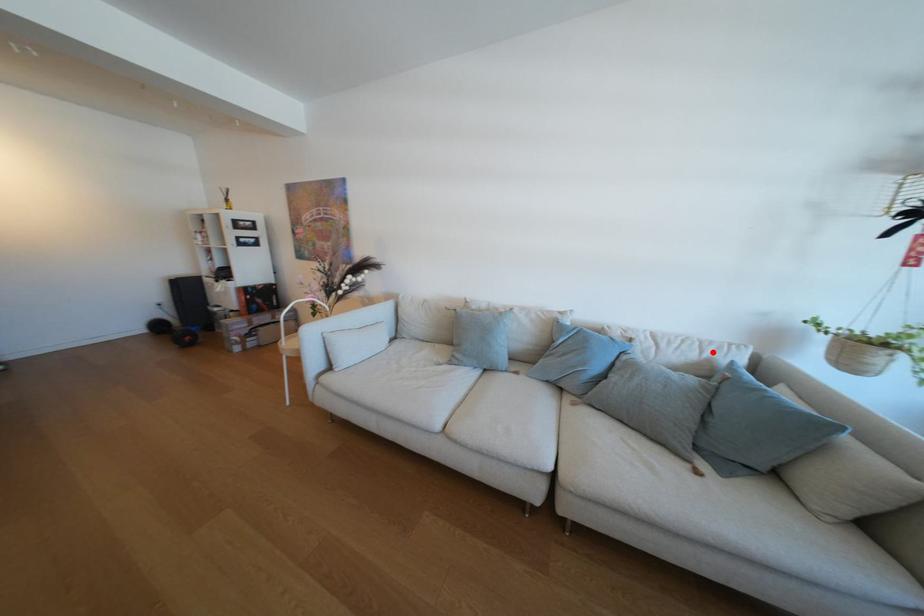
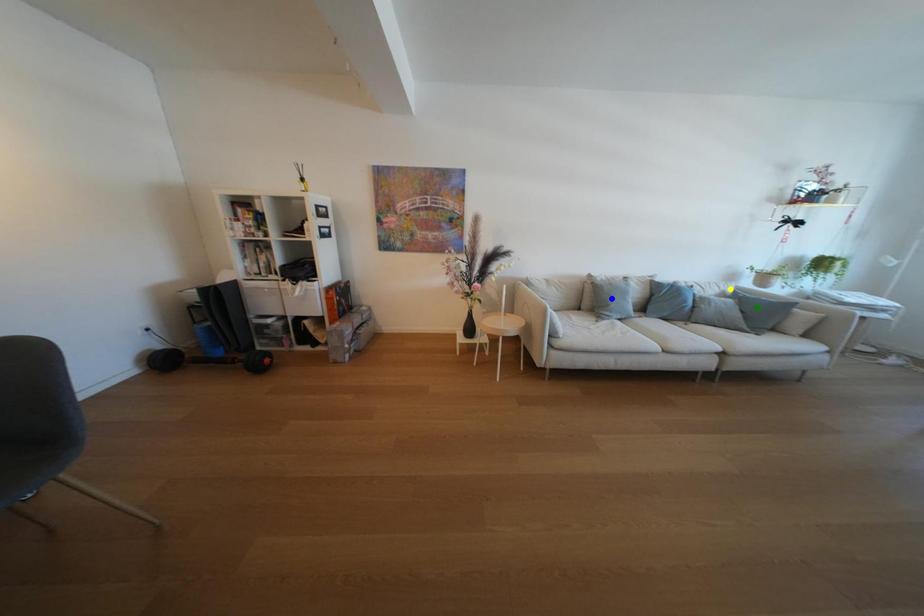
Question: I am providing you with two images of the same scene from different viewpoints. A red point is marked on the first image. You are given multiple points on the second image. Which point in image 2 is actually the same real-world point as the red point in image 1?

Choices:
 (A) green point
 (B) yellow point
 (C) blue point

Answer: (B)